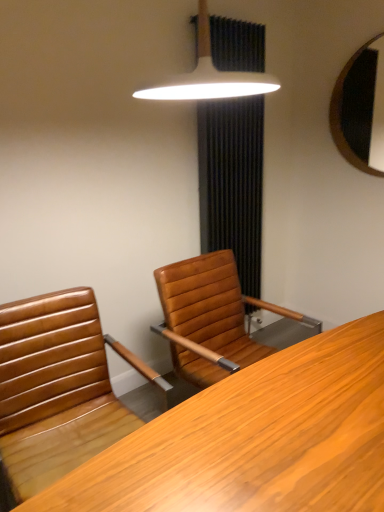
This screenshot has height=512, width=384. What do you see at coordinates (209, 76) in the screenshot? I see `white glossy lampshade at upper center` at bounding box center [209, 76].

Locate an element on the screen. This screenshot has width=384, height=512. white glossy lampshade at upper center is located at coordinates (209, 76).

The width and height of the screenshot is (384, 512). I want to click on black fabric curtain at upper center, so click(232, 183).

What do you see at coordinates (360, 106) in the screenshot? This screenshot has width=384, height=512. I see `wooden mirror at upper right` at bounding box center [360, 106].

What is the approximate width of wooden desk at center?

21.29 inches.

Identify the location of white glossy lampshade at upper center. (209, 76).

Looking at this image, from the image's perspective, which one is positioned higher, black fabric curtain at upper center or wooden mirror at upper right?

wooden mirror at upper right.

Which is behind, black fabric curtain at upper center or wooden mirror at upper right?

Positioned behind is wooden mirror at upper right.

Is black fabric curtain at upper center wider than wooden mirror at upper right?

Correct, the width of black fabric curtain at upper center exceeds that of wooden mirror at upper right.

Is black fabric curtain at upper center next to wooden mirror at upper right and touching it?

They are not placed beside each other.

Considering their positions, is brown leather chair at center located in front of or behind white glossy lampshade at upper center?

In the image, brown leather chair at center appears behind white glossy lampshade at upper center.

The height and width of the screenshot is (512, 384). I want to click on lamp above the brown leather chair at center (from a real-world perspective), so click(x=209, y=76).

Is brown leather chair at center not near white glossy lampshade at upper center?

Indeed, brown leather chair at center is not near white glossy lampshade at upper center.

Based on the photo, from the image's perspective, between brown leather chair at center and white glossy lampshade at upper center, who is located below?

brown leather chair at center, from the image's perspective.

Which is closer to the camera, [370,144] or [226,104]?

Positioned in front is point [226,104].

From the picture: Does wooden mirror at upper right have a larger size compared to black fabric curtain at upper center?

No.

How distant is wooden mirror at upper right from black fabric curtain at upper center?

wooden mirror at upper right is 79.20 centimeters away from black fabric curtain at upper center.

Considering their positions, is wooden mirror at upper right located in front of or behind black fabric curtain at upper center?

Clearly, wooden mirror at upper right is behind black fabric curtain at upper center.

Based on the photo, is black fabric curtain at upper center in front of wooden desk at center?

That is False.

Between black fabric curtain at upper center and wooden desk at center, which one has larger size?

wooden desk at center is bigger.

Is black fabric curtain at upper center thinner than wooden desk at center?

Correct, the width of black fabric curtain at upper center is less than that of wooden desk at center.

The height and width of the screenshot is (512, 384). I want to click on curtain located on the left of wooden desk at center, so click(x=232, y=183).

Where is `curtain above the brown leather chair at center (from a real-world perspective)`? curtain above the brown leather chair at center (from a real-world perspective) is located at coordinates (232, 183).

Considering the sizes of objects brown leather chair at center and black fabric curtain at upper center in the image provided, who is smaller, brown leather chair at center or black fabric curtain at upper center?

black fabric curtain at upper center.

Is brown leather chair at center oriented away from black fabric curtain at upper center?

That's not correct — brown leather chair at center is not looking away from black fabric curtain at upper center.

In the image, is brown leather chair at center on the left side or the right side of black fabric curtain at upper center?

brown leather chair at center is to the left of black fabric curtain at upper center.

Who is bigger, brown leather chair at center or wooden desk at center?

Bigger between the two is wooden desk at center.

From the image's perspective, which object appears higher, brown leather chair at center or wooden desk at center?

brown leather chair at center appears higher in the image.

Is wooden desk at center completely or partially inside brown leather chair at center?

Definitely not — wooden desk at center is not inside brown leather chair at center.

Relative to wooden desk at center, is brown leather chair at center in front or behind?

brown leather chair at center is positioned farther from the viewer than wooden desk at center.

Is white glossy lampshade at upper center taller than black fabric curtain at upper center?

In fact, white glossy lampshade at upper center may be shorter than black fabric curtain at upper center.

In terms of width, does white glossy lampshade at upper center look wider or thinner when compared to black fabric curtain at upper center?

Clearly, white glossy lampshade at upper center has more width compared to black fabric curtain at upper center.

Is point (199, 3) positioned in front of point (210, 25)?

That is True.

Is white glossy lampshade at upper center in contact with black fabric curtain at upper center?

No, white glossy lampshade at upper center is not with black fabric curtain at upper center.

Locate an element on the screen. This screenshot has width=384, height=512. curtain lying below the wooden mirror at upper right (from the image's perspective) is located at coordinates [232, 183].

Where is `chair below the white glossy lampshade at upper center (from a real-world perspective)`? This screenshot has height=512, width=384. chair below the white glossy lampshade at upper center (from a real-world perspective) is located at coordinates (58, 387).

From the image, which object appears to be nearer to brown leather chair at center, wooden desk at center or black fabric curtain at upper center?

wooden desk at center is positioned closer to the anchor brown leather chair at center.

Estimate the real-world distances between objects in this image. Which object is closer to wooden desk at center, wooden mirror at upper right or black fabric curtain at upper center?

Among the two, black fabric curtain at upper center is located nearer to wooden desk at center.

Considering their positions, is brown leather chair at center positioned further to white glossy lampshade at upper center than wooden mirror at upper right?

brown leather chair at center lies further to white glossy lampshade at upper center than the other object.

From the image, which object appears to be nearer to white glossy lampshade at upper center, brown leather chair at center or black fabric curtain at upper center?

black fabric curtain at upper center.

Considering their positions, is wooden desk at center positioned further to white glossy lampshade at upper center than brown leather chair at center?

The object further to white glossy lampshade at upper center is wooden desk at center.

Based on their spatial positions, is wooden desk at center or brown leather chair at center further from wooden mirror at upper right?

Among the two, brown leather chair at center is located further to wooden mirror at upper right.

When comparing their distances from white glossy lampshade at upper center, does wooden desk at center or wooden mirror at upper right seem further?

The object further to white glossy lampshade at upper center is wooden desk at center.

Considering their positions, is wooden mirror at upper right positioned closer to wooden desk at center than white glossy lampshade at upper center?

white glossy lampshade at upper center lies closer to wooden desk at center than the other object.

In order to click on chair that lies between white glossy lampshade at upper center and wooden desk at center from top to bottom in this screenshot , I will do (58, 387).

The height and width of the screenshot is (512, 384). In order to click on curtain located between wooden desk at center and wooden mirror at upper right in the depth direction in this screenshot , I will do `click(232, 183)`.

This screenshot has width=384, height=512. I want to click on lamp positioned between wooden desk at center and black fabric curtain at upper center from near to far, so pyautogui.click(x=209, y=76).

In order to click on curtain that lies between wooden mirror at upper right and brown leather chair at center from top to bottom in this screenshot , I will do `click(232, 183)`.